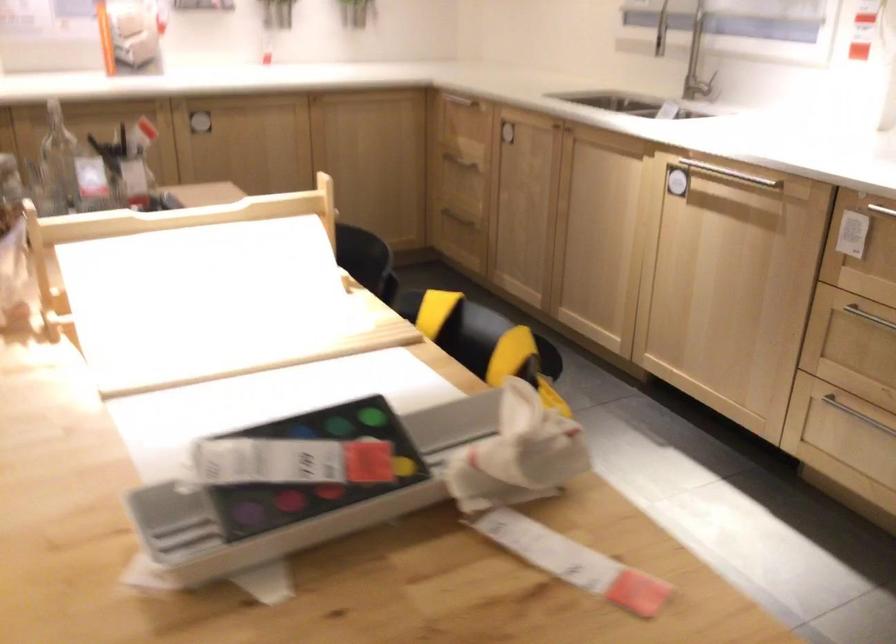
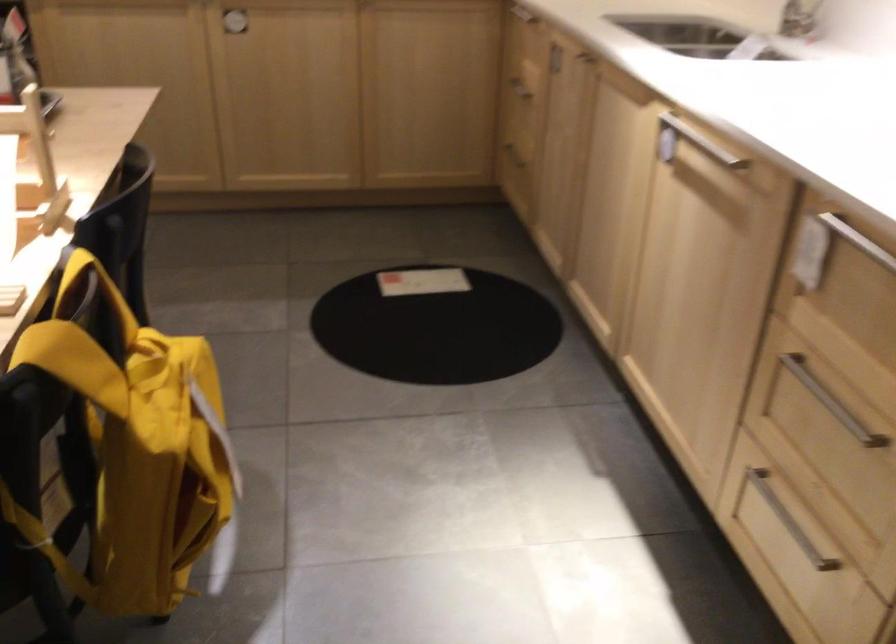
Which direction would the cameraman need to move to produce the second image?

The cameraman walked toward right, forward.